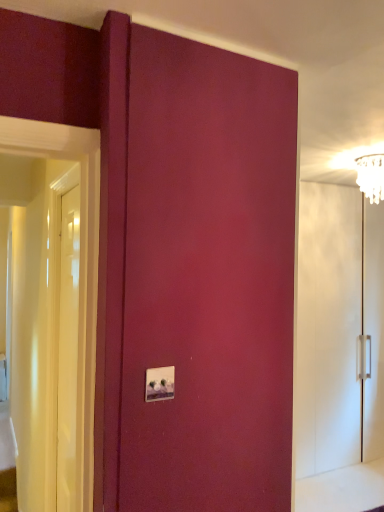
Question: Should I look upward or downward to see white glossy door at left?

Choices:
 (A) up
 (B) down

Answer: (B)

Question: Does white glossy light switch at center have a greater height compared to clear glass chandelier at upper right?

Choices:
 (A) no
 (B) yes

Answer: (A)

Question: Does white glossy light switch at center appear on the left side of clear glass chandelier at upper right?

Choices:
 (A) no
 (B) yes

Answer: (B)

Question: Is white glossy light switch at center not close to clear glass chandelier at upper right?

Choices:
 (A) no
 (B) yes

Answer: (B)

Question: From the image's perspective, does white glossy light switch at center appear higher than clear glass chandelier at upper right?

Choices:
 (A) no
 (B) yes

Answer: (A)

Question: Is clear glass chandelier at upper right inside white glossy light switch at center?

Choices:
 (A) no
 (B) yes

Answer: (A)

Question: Can you confirm if white glossy light switch at center is shorter than clear glass chandelier at upper right?

Choices:
 (A) yes
 (B) no

Answer: (A)

Question: Is clear glass chandelier at upper right aimed at white glossy light switch at center?

Choices:
 (A) no
 (B) yes

Answer: (A)

Question: Is clear glass chandelier at upper right shorter than white glossy light switch at center?

Choices:
 (A) yes
 (B) no

Answer: (B)

Question: Considering the relative sizes of clear glass chandelier at upper right and white glossy light switch at center in the image provided, is clear glass chandelier at upper right smaller than white glossy light switch at center?

Choices:
 (A) no
 (B) yes

Answer: (A)

Question: Is clear glass chandelier at upper right outside white glossy light switch at center?

Choices:
 (A) no
 (B) yes

Answer: (B)

Question: Is clear glass chandelier at upper right in contact with white glossy light switch at center?

Choices:
 (A) yes
 (B) no

Answer: (B)

Question: From the image's perspective, is clear glass chandelier at upper right on top of white glossy light switch at center?

Choices:
 (A) yes
 (B) no

Answer: (A)

Question: Considering the relative sizes of white glossy door at left and white glossy cabinet at right in the image provided, is white glossy door at left thinner than white glossy cabinet at right?

Choices:
 (A) yes
 (B) no

Answer: (A)